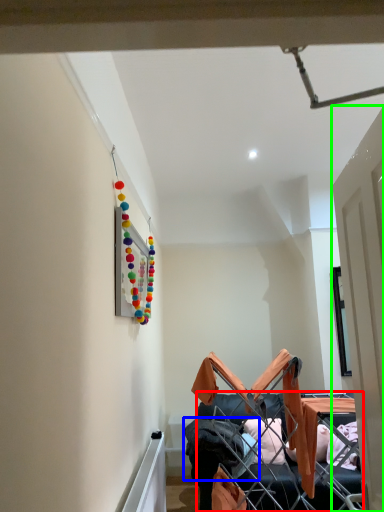
Question: Based on their relative distances, which object is nearer to furniture (highlighted by a red box)? Choose from clothing (highlighted by a blue box) and door (highlighted by a green box).

Choices:
 (A) clothing
 (B) door

Answer: (A)